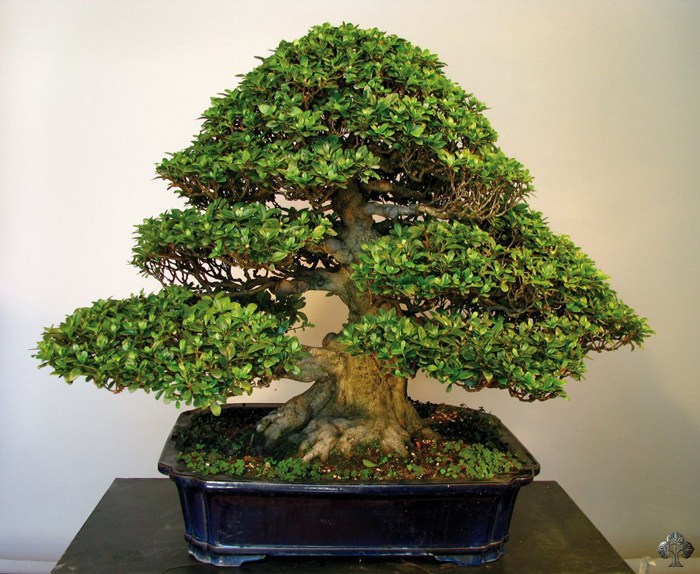
Find the location of a particular element. Image resolution: width=700 pixels, height=574 pixels. white wall is located at coordinates (59, 436), (595, 203), (87, 157), (642, 433).